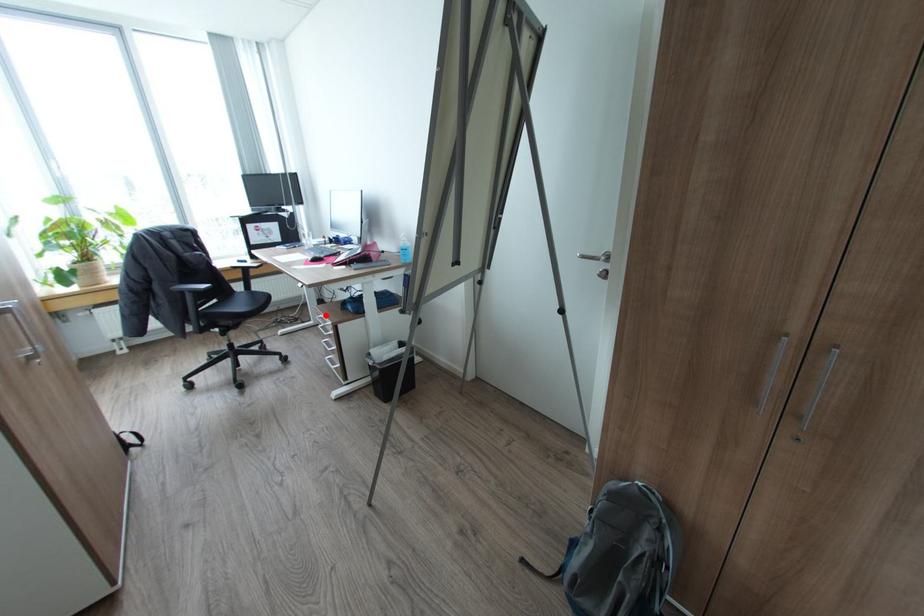
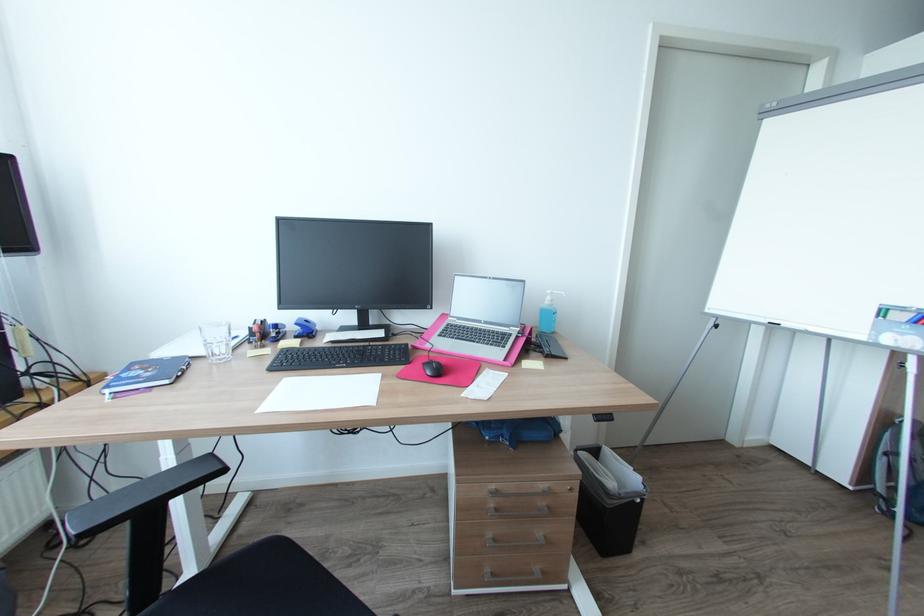
In the second image, find the point that corresponds to the highlighted location in the first image.

(497, 487)